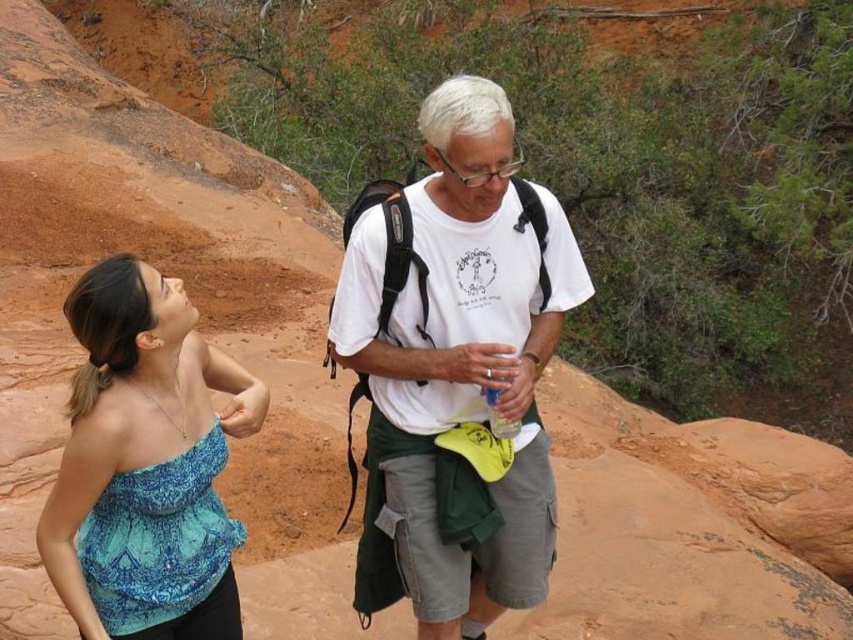
Question: Considering the real-world distances, which object is closest to the white cotton t-shirt at center?

Choices:
 (A) white cotton shirt at center
 (B) blue printed fabric top at left

Answer: (A)

Question: Does white cotton shirt at center have a greater width compared to blue printed fabric top at left?

Choices:
 (A) no
 (B) yes

Answer: (B)

Question: Can you confirm if white cotton shirt at center is thinner than blue printed fabric top at left?

Choices:
 (A) yes
 (B) no

Answer: (B)

Question: Can you confirm if white cotton shirt at center is positioned to the right of white cotton t-shirt at center?

Choices:
 (A) yes
 (B) no

Answer: (A)

Question: Estimate the real-world distances between objects in this image. Which object is farther from the white cotton shirt at center?

Choices:
 (A) white cotton t-shirt at center
 (B) blue printed fabric top at left

Answer: (B)

Question: Which point is farther to the camera?

Choices:
 (A) (209, 588)
 (B) (570, 262)

Answer: (B)